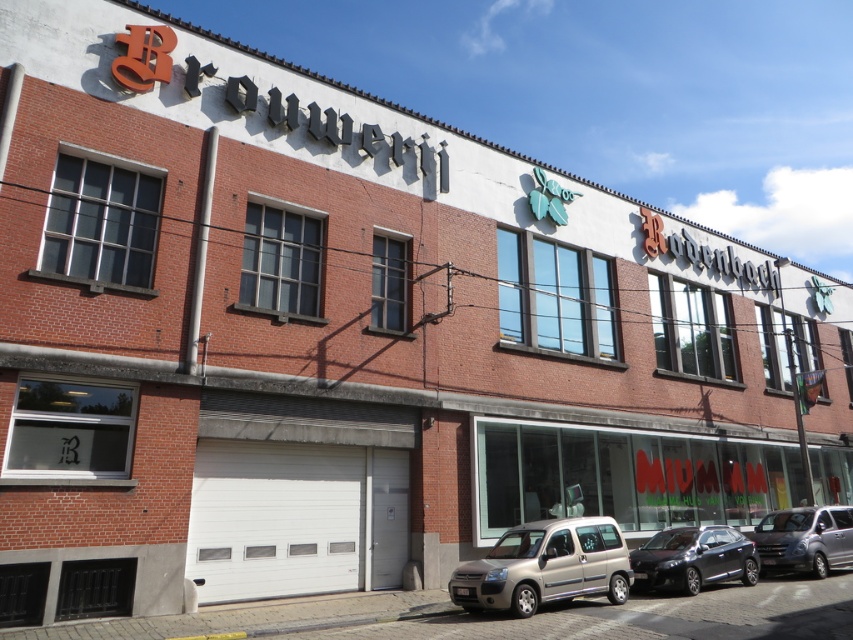
Question: Is silver metallic van at center smaller than satin black car at lower center?

Choices:
 (A) no
 (B) yes

Answer: (A)

Question: Which is farther from the satin black car at lower center?

Choices:
 (A) metallic silver van at lower right
 (B) silver metallic van at center

Answer: (A)

Question: Does satin black car at lower center appear on the right side of metallic silver van at lower right?

Choices:
 (A) yes
 (B) no

Answer: (B)

Question: Which point is farther from the camera taking this photo?

Choices:
 (A) (717, 557)
 (B) (764, 532)
 (C) (456, 602)

Answer: (B)

Question: Which point appears farthest from the camera in this image?

Choices:
 (A) (807, 570)
 (B) (537, 573)

Answer: (A)

Question: Does silver metallic van at center lie behind metallic silver van at lower right?

Choices:
 (A) no
 (B) yes

Answer: (A)